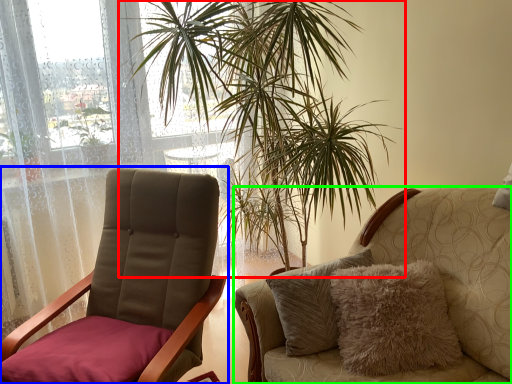
Question: Which is nearer to the houseplant (highlighted by a red box)? chair (highlighted by a blue box) or chair (highlighted by a green box).

Choices:
 (A) chair
 (B) chair

Answer: (A)